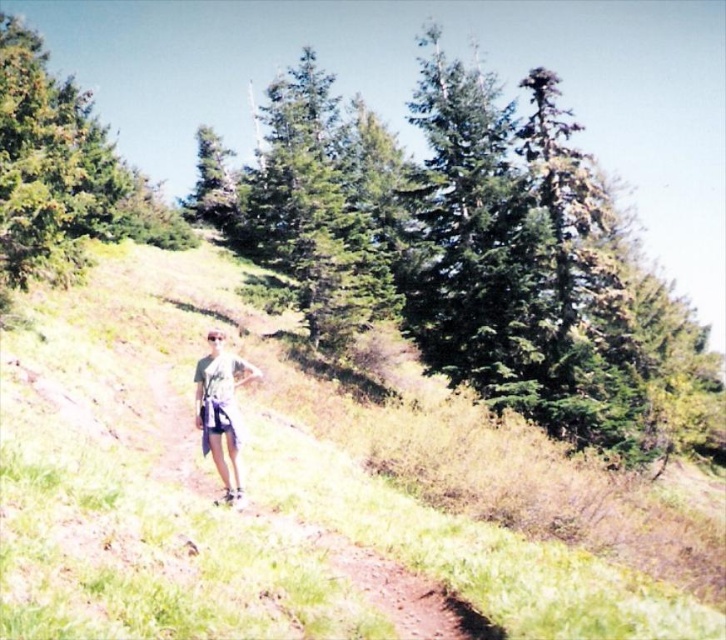
Between green grassy hillside at center and light gray fabric shorts at center, which one appears on the right side from the viewer's perspective?

Positioned to the right is light gray fabric shorts at center.

Does point (293, 454) come behind point (221, 364)?

That is True.

Locate an element on the screen. Image resolution: width=726 pixels, height=640 pixels. green grassy hillside at center is located at coordinates (293, 490).

Can you confirm if green grassy hillside at center is thinner than gravel path at center?

No.

What do you see at coordinates (293, 490) in the screenshot? I see `green grassy hillside at center` at bounding box center [293, 490].

Find the location of a particular element. This screenshot has height=640, width=726. green grassy hillside at center is located at coordinates (293, 490).

From the picture: Can you confirm if green textured pine tree at center is thinner than white cotton shorts at center?

Incorrect, green textured pine tree at center's width is not less than white cotton shorts at center's.

Consider the image. Who is higher up, green textured pine tree at center or white cotton shorts at center?

green textured pine tree at center

Who is more distant from viewer, [363,208] or [232,420]?

Point [363,208]

The height and width of the screenshot is (640, 726). Identify the location of green textured pine tree at center. (473, 253).